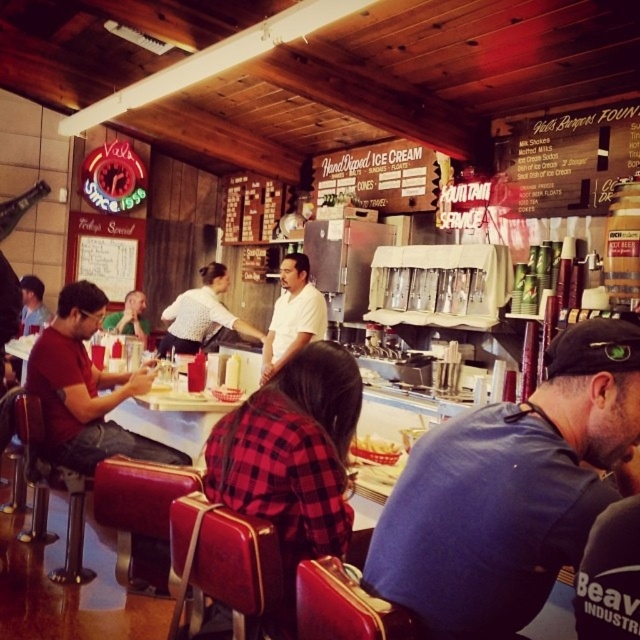
You are a customer at the diner and want to read the white paperboard menu at upper right. You notice the matte black shirt at left is blocking your view. Can you tell if the menu is wider than the shirt?

The white paperboard menu at upper right is narrower than the matte black shirt at left, so it might be fully blocked by the shirt.

From the picture: You are a diner employee who needs to place a 12 inch wide menu between the white shirt at center and the matte black shirt at left. Can you fit it there?

The white shirt at center is wider than the matte black shirt at left. The total width between them is not specified, but since the menu is 12 inches wide, you need to ensure there is enough space. However, without knowing the exact distance between the shirts, it is impossible to determine if the menu will fit.